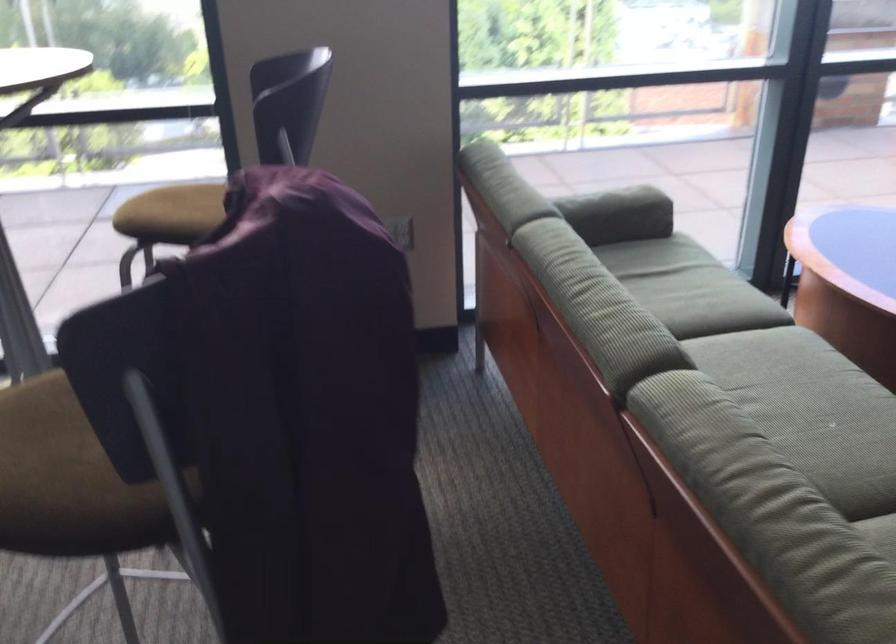
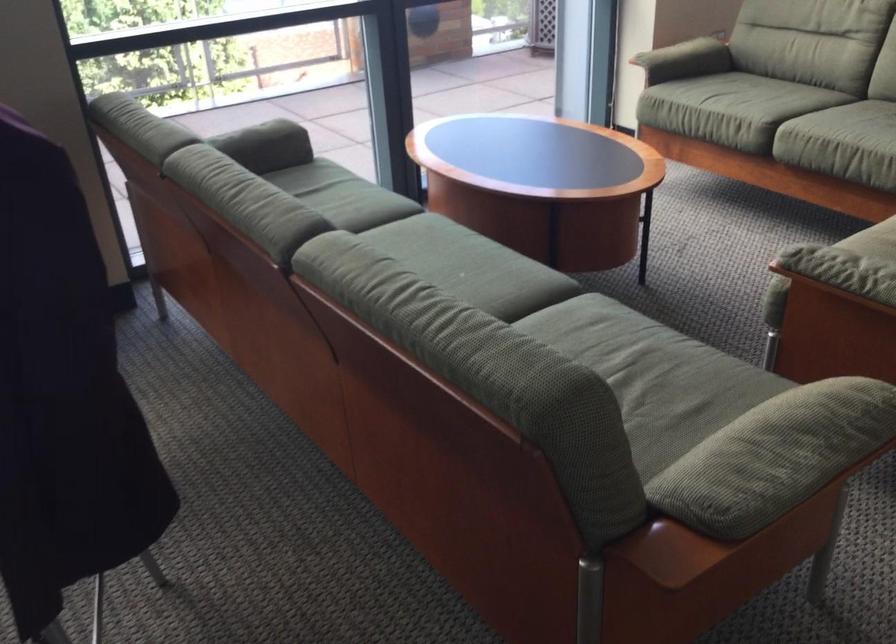
Question: The camera is either moving clockwise (left) or counter-clockwise (right) around the object. The first image is from the beginning of the video and the second image is from the end. Is the camera moving left or right when shooting the video?

Choices:
 (A) Left
 (B) Right

Answer: (A)